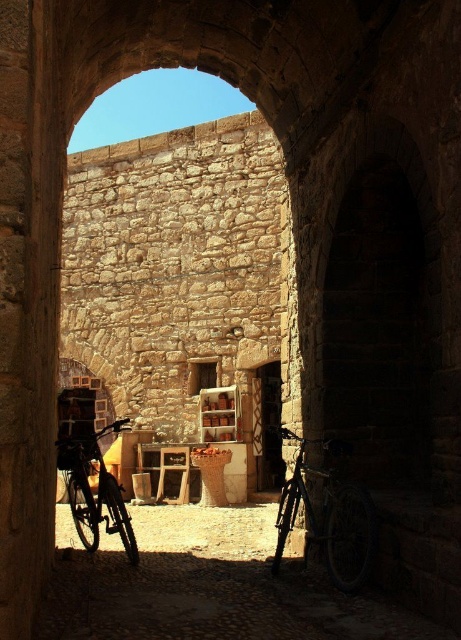
Does shiny metallic bicycle at center have a lesser height compared to shiny black bicycle at left?

Indeed, shiny metallic bicycle at center has a lesser height compared to shiny black bicycle at left.

Measure the distance between shiny metallic bicycle at center and camera.

A distance of 26.17 meters exists between shiny metallic bicycle at center and camera.

Does point (326, 540) come in front of point (136, 556)?

Yes, it is in front of point (136, 556).

Where is `shiny metallic bicycle at center`? shiny metallic bicycle at center is located at coordinates (329, 522).

Is metallic bicycle at center shorter than shiny black bicycle at left?

Indeed, metallic bicycle at center has a lesser height compared to shiny black bicycle at left.

Does metallic bicycle at center have a larger size compared to shiny black bicycle at left?

No, metallic bicycle at center is not bigger than shiny black bicycle at left.

Which is in front, point (312, 582) or point (84, 477)?

Point (312, 582) is more forward.

You are a GUI agent. You are given a task and a screenshot of the screen. Output one action in this format:
    pyautogui.click(x=<x>, y=<y>)
    Task: Click on the metallic bicycle at center
    
    Given the screenshot: What is the action you would take?
    click(x=206, y=586)

Can you confirm if metallic bicycle at center is smaller than shiny metallic bicycle at center?

Incorrect, metallic bicycle at center is not smaller in size than shiny metallic bicycle at center.

Can you confirm if metallic bicycle at center is shorter than shiny metallic bicycle at center?

Yes, metallic bicycle at center is shorter than shiny metallic bicycle at center.

Identify the location of metallic bicycle at center. The width and height of the screenshot is (461, 640). (206, 586).

Find the location of a particular element. The width and height of the screenshot is (461, 640). metallic bicycle at center is located at coordinates pyautogui.click(x=206, y=586).